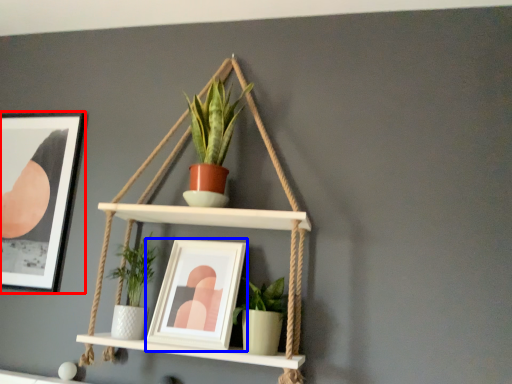
Question: Which object appears farthest to the camera in this image, picture frame (highlighted by a red box) or picture frame (highlighted by a blue box)?

Choices:
 (A) picture frame
 (B) picture frame

Answer: (A)